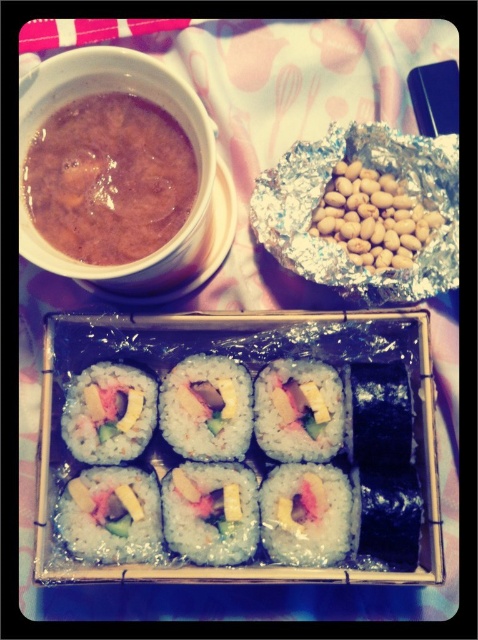
Is point (206, 422) closer to viewer compared to point (130, 230)?

No, (206, 422) is further to viewer.

Identify the location of sushi at center. pos(239,465).

Does brown matte soup at upper left appear on the left side of white rice roll at center?

Yes, brown matte soup at upper left is to the left of white rice roll at center.

Does brown matte soup at upper left have a greater width compared to white rice roll at center?

Yes, brown matte soup at upper left is wider than white rice roll at center.

Measure the distance between point (73, 164) and camera.

38.28 inches

The height and width of the screenshot is (640, 478). Identify the location of brown matte soup at upper left. (109, 179).

Is brown matte soup at upper left above shiny white rice roll at center?

Indeed, brown matte soup at upper left is positioned over shiny white rice roll at center.

Measure the distance from brown matte soup at upper left to shiny white rice roll at center.

They are 13.32 inches apart.

The width and height of the screenshot is (478, 640). I want to click on brown matte soup at upper left, so click(109, 179).

This screenshot has width=478, height=640. Find the location of `brown matte soup at upper left`. brown matte soup at upper left is located at coordinates (109, 179).